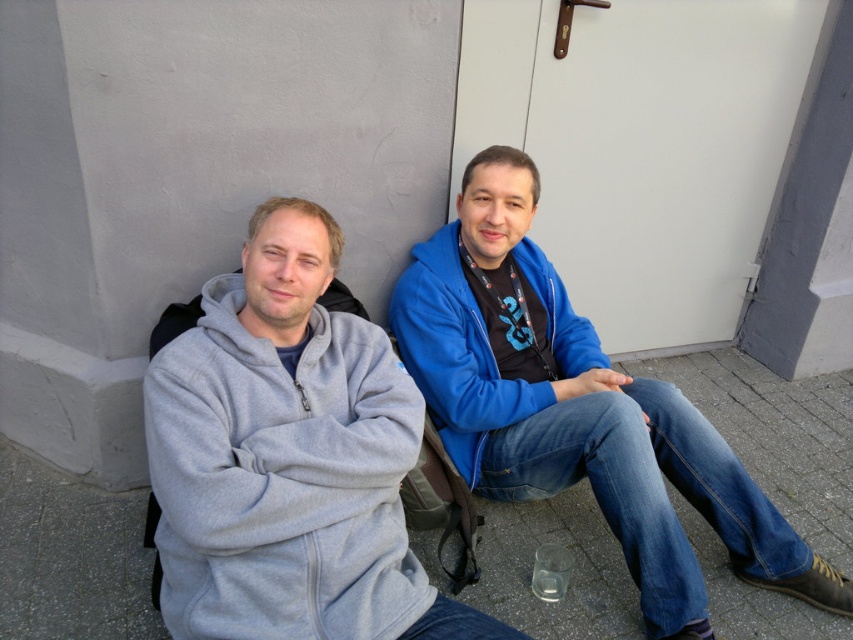
Can you confirm if gray fleece hoodie at left is shorter than blue fleece jacket at center?

Answer: Indeed, gray fleece hoodie at left has a lesser height compared to blue fleece jacket at center.

Does point (198, 547) come closer to viewer compared to point (848, 582)?

That is True.

Identify the location of gray fleece hoodie at left. The width and height of the screenshot is (853, 640). (288, 458).

Is gray fleece hoodie at left above blue fleece sweatshirt at center?

No.

Is point (379, 326) closer to viewer compared to point (471, 317)?

Yes, point (379, 326) is in front of point (471, 317).

Locate an element on the screen. The width and height of the screenshot is (853, 640). gray fleece hoodie at left is located at coordinates (288, 458).

Is blue fleece jacket at center wider than blue fleece sweatshirt at center?

Correct, the width of blue fleece jacket at center exceeds that of blue fleece sweatshirt at center.

Which is behind, point (573, 413) or point (471, 451)?

The point (471, 451) is behind.

Identify the location of blue fleece jacket at center. The image size is (853, 640). (577, 410).